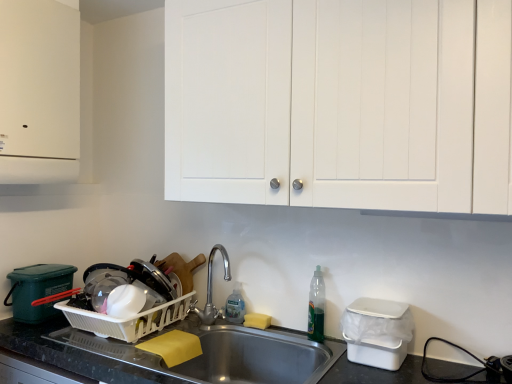
Question: Is translucent plastic bottle at sink right, arranged as the second bottle when viewed from the back, outside of white plastic dish rack at lower left, positioned as the first appliance in back-to-front order?

Choices:
 (A) yes
 (B) no

Answer: (A)

Question: Is translucent plastic bottle at sink right, the second bottle in the left-to-right sequence, further to camera compared to white plastic dish rack at lower left, the 2th appliance when ordered from right to left?

Choices:
 (A) no
 (B) yes

Answer: (B)

Question: Does translucent plastic bottle at sink right, which is counted as the 1th bottle, starting from the right, lie in front of white plastic dish rack at lower left, the 2th appliance when ordered from right to left?

Choices:
 (A) yes
 (B) no

Answer: (B)

Question: Is translucent plastic bottle at sink right, arranged as the second bottle when viewed from the back, at the left side of white plastic dish rack at lower left, the first appliance positioned from the left?

Choices:
 (A) yes
 (B) no

Answer: (B)

Question: From the image's perspective, is translucent plastic bottle at sink right, which is counted as the 1th bottle, starting from the right, on white plastic dish rack at lower left, the first appliance positioned from the left?

Choices:
 (A) no
 (B) yes

Answer: (B)

Question: From their relative heights in the image, would you say clear plastic bottle at sink, positioned as the 1th bottle in left-to-right order, is taller or shorter than stainless steel sink at lower center?

Choices:
 (A) tall
 (B) short

Answer: (B)

Question: Is point (231, 302) closer or farther from the camera than point (209, 372)?

Choices:
 (A) closer
 (B) farther

Answer: (B)

Question: In terms of size, does clear plastic bottle at sink, the second bottle viewed from the front, appear bigger or smaller than stainless steel sink at lower center?

Choices:
 (A) small
 (B) big

Answer: (A)

Question: Is clear plastic bottle at sink, the second bottle viewed from the front, inside the boundaries of stainless steel sink at lower center, or outside?

Choices:
 (A) outside
 (B) inside

Answer: (A)

Question: Choose the correct answer: Is white plastic dish rack at lower left, the 2th appliance when ordered from right to left, inside clear plastic bottle at sink, positioned as the 1th bottle in left-to-right order, or outside it?

Choices:
 (A) inside
 (B) outside

Answer: (B)

Question: Based on their sizes in the image, would you say white plastic dish rack at lower left, marked as the 2th appliance in a front-to-back arrangement, is bigger or smaller than clear plastic bottle at sink, the 2th bottle positioned from the right?

Choices:
 (A) small
 (B) big

Answer: (B)

Question: Considering the positions of white plastic dish rack at lower left, the first appliance positioned from the left, and clear plastic bottle at sink, the second bottle viewed from the front, in the image, is white plastic dish rack at lower left, the first appliance positioned from the left, taller or shorter than clear plastic bottle at sink, the second bottle viewed from the front,?

Choices:
 (A) tall
 (B) short

Answer: (B)

Question: Is white plastic dish rack at lower left, the first appliance positioned from the left, wider or thinner than clear plastic bottle at sink, the 1th bottle from the back?

Choices:
 (A) thin
 (B) wide

Answer: (B)

Question: Considering the relative positions of translucent plastic bottle at sink right, which is counted as the 1th bottle, starting from the right, and white matte cabinet doors at upper center, arranged as the 1th cabinetry when viewed from the right, in the image provided, is translucent plastic bottle at sink right, which is counted as the 1th bottle, starting from the right, to the left or to the right of white matte cabinet doors at upper center, arranged as the 1th cabinetry when viewed from the right,?

Choices:
 (A) right
 (B) left

Answer: (A)

Question: Considering the positions of point click(x=308, y=321) and point click(x=245, y=16), is point click(x=308, y=321) closer or farther from the camera than point click(x=245, y=16)?

Choices:
 (A) farther
 (B) closer

Answer: (A)